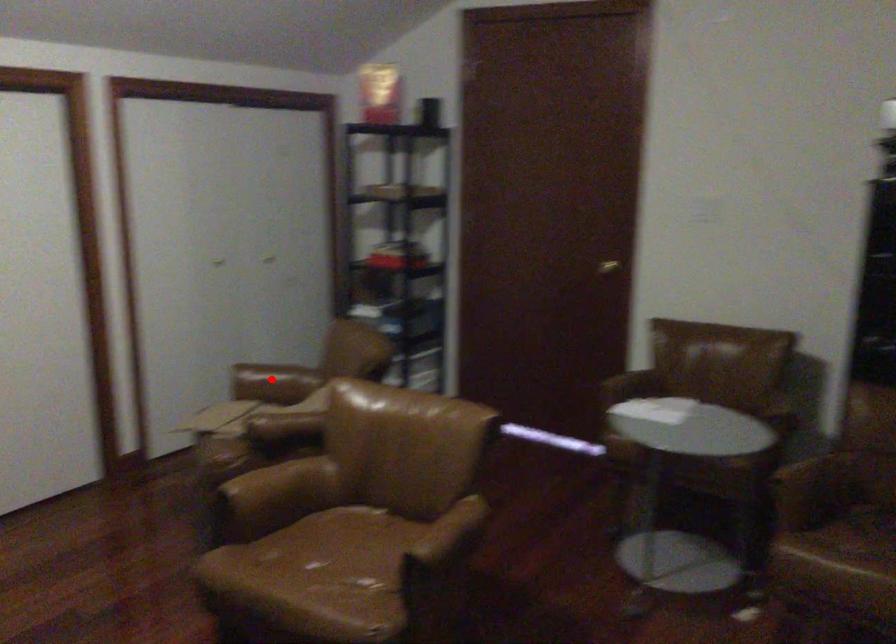
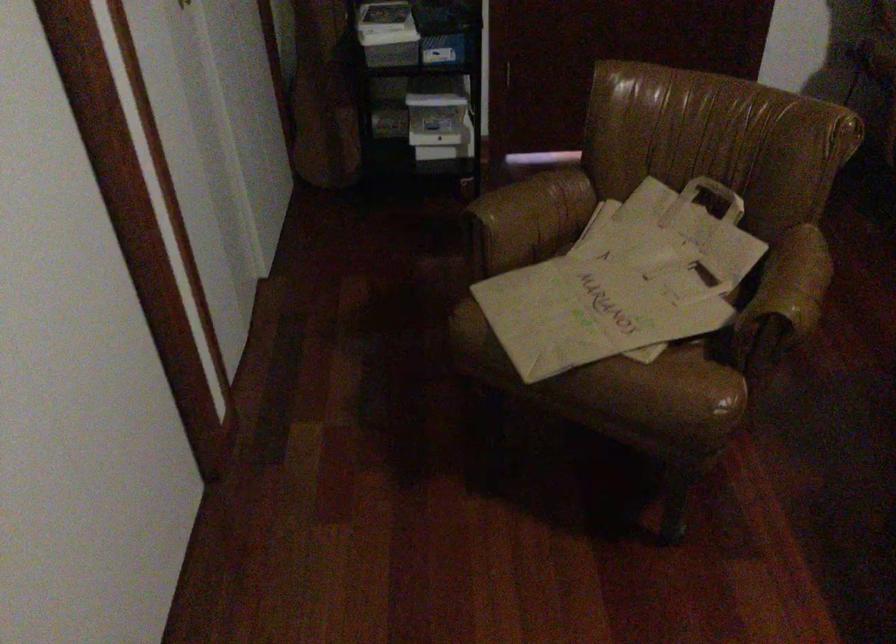
Question: I am providing you with two images of the same scene from different viewpoints. A red point is marked on the first image. At the location where the point appears in image 1, is it still visible in image 2?

Choices:
 (A) Yes
 (B) No

Answer: (A)